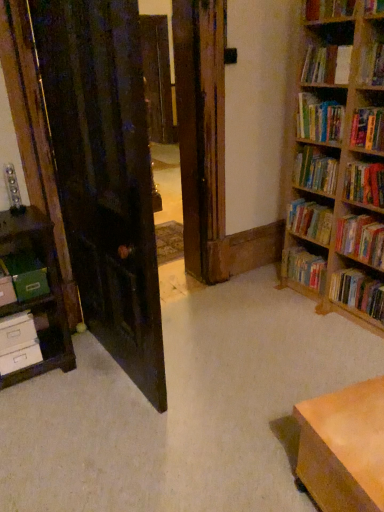
Image resolution: width=384 pixels, height=512 pixels. In order to click on free space to the left of dark wood door at left in this screenshot , I will do `click(64, 380)`.